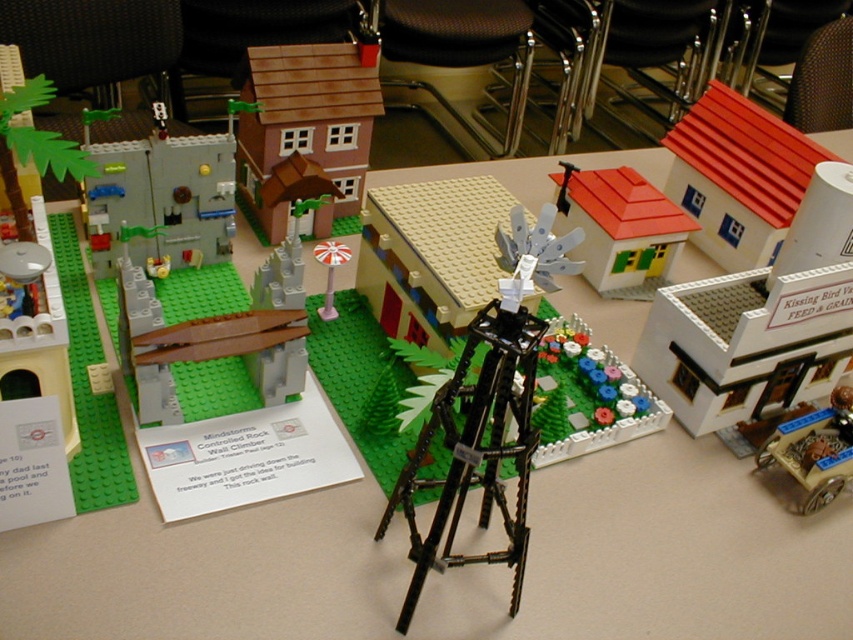
From the picture: You are an architect reviewing a Lego model. You notice the smooth plastic house at upper right and the smooth gray wall at left. Which object would require more materials to construct in a full scale version?

The smooth plastic house at upper right requires more materials because it has a larger size compared to the smooth gray wall at left.

You are a Lego enthusiast examining the model. You notice the smooth plastic house at upper right and the smooth gray wall at left. Which object is located higher in the image?

The smooth plastic house at upper right is positioned over the smooth gray wall at left, so it is higher in the image.